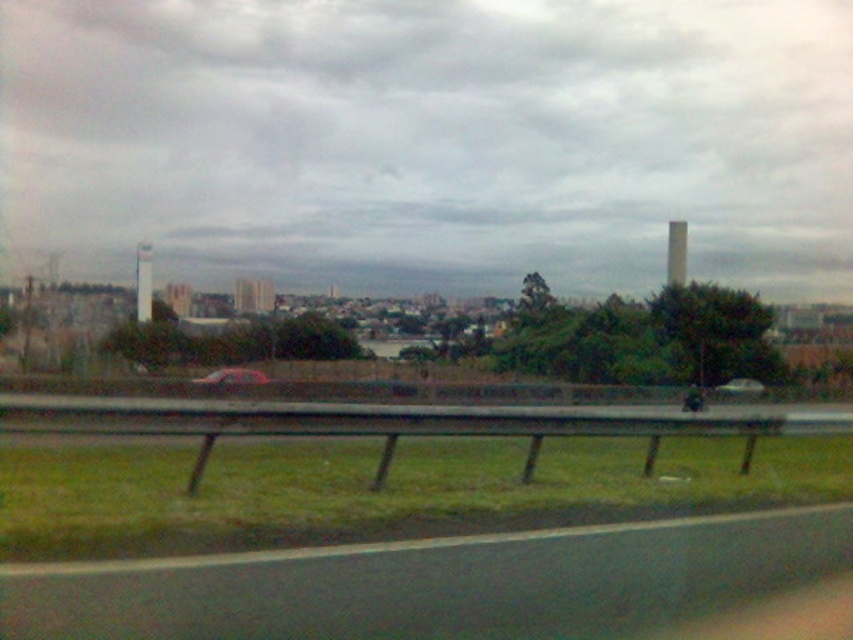
Does point (683, 557) come closer to viewer compared to point (726, 392)?

Yes.

Can you confirm if black asphalt highway at lower center is smaller than metallic silver sedan at center?

Correct, black asphalt highway at lower center occupies less space than metallic silver sedan at center.

The image size is (853, 640). Describe the element at coordinates (438, 582) in the screenshot. I see `black asphalt highway at lower center` at that location.

At what (x,y) coordinates should I click in order to perform the action: click on black asphalt highway at lower center. Please return your answer as a coordinate pair (x, y). The height and width of the screenshot is (640, 853). Looking at the image, I should click on (438, 582).

Is metallic silver car at center to the right of metallic silver sedan at center from the viewer's perspective?

Incorrect, metallic silver car at center is not on the right side of metallic silver sedan at center.

Which is behind, point (260, 380) or point (735, 380)?

Positioned behind is point (735, 380).

At what (x,y) coordinates should I click in order to perform the action: click on metallic silver car at center. Please return your answer as a coordinate pair (x, y). Image resolution: width=853 pixels, height=640 pixels. Looking at the image, I should click on (231, 376).

Is black asphalt highway at lower center to the left of metallic silver car at center from the viewer's perspective?

Incorrect, black asphalt highway at lower center is not on the left side of metallic silver car at center.

You are a GUI agent. You are given a task and a screenshot of the screen. Output one action in this format:
    pyautogui.click(x=<x>, y=<y>)
    Task: Click on the black asphalt highway at lower center
    
    Given the screenshot: What is the action you would take?
    pyautogui.click(x=438, y=582)